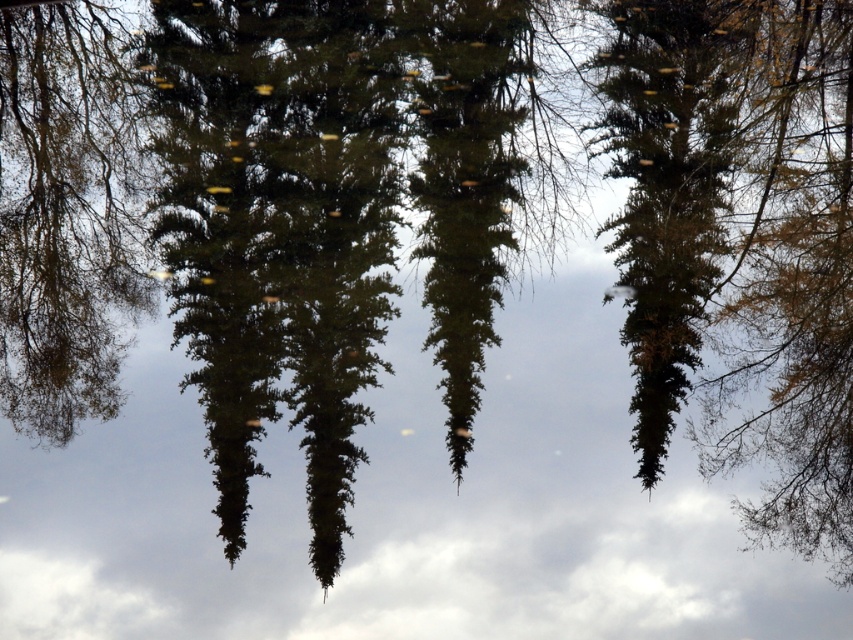
You are a photographer planning to capture the reflection of the green matte tree at left and the green matte tree at center in the water. Which tree will have a larger reflection in the water?

The green matte tree at left is bigger than the green matte tree at center, so its reflection will also be larger in the water.

You are standing at the center of the image and see a point labeled as point (793,289). Based on the scene description, where is this point located in relation to the yellow green needles at right?

The point (793,289) is located on the yellow green needles at right according to the description.